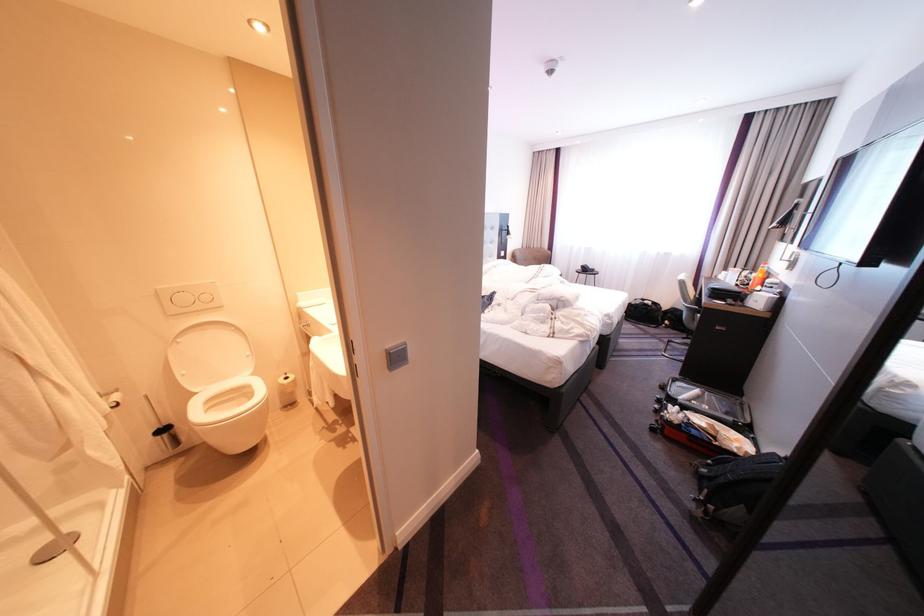
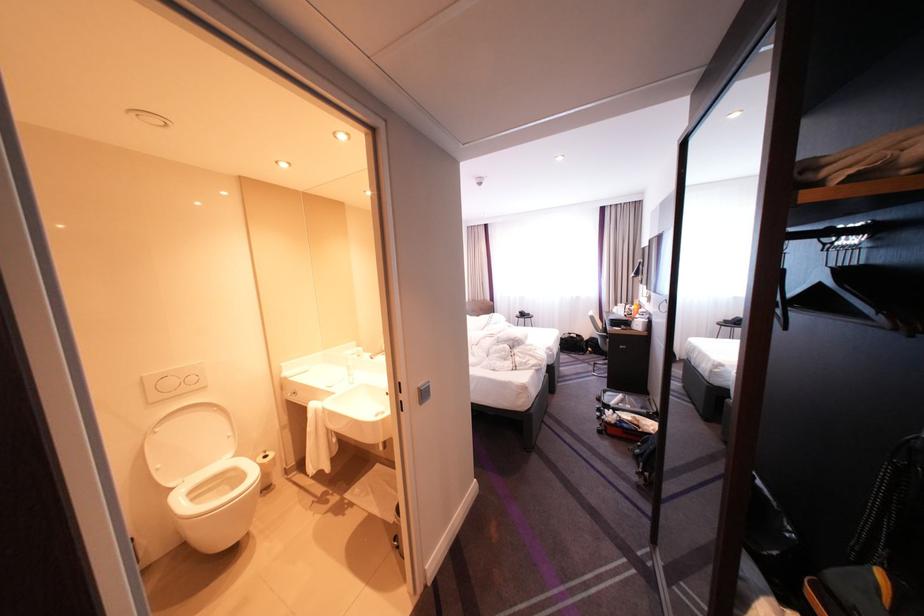
Where in the second image is the point corresponding to (x=677, y=308) from the first image?

(599, 338)